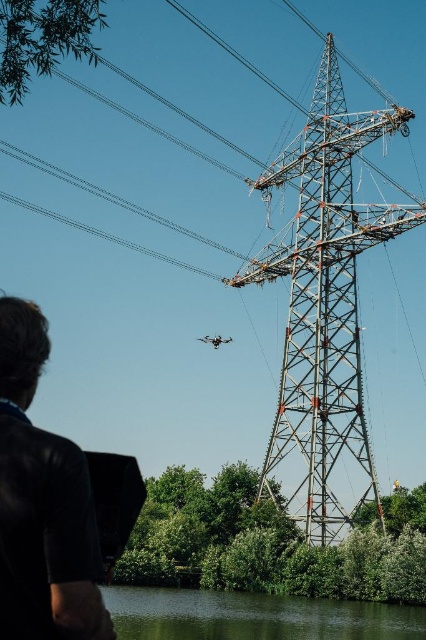
Question: Can you confirm if dark blue leather shirt at lower left is positioned below green smooth water at lower center?

Choices:
 (A) yes
 (B) no

Answer: (B)

Question: Among these points, which one is farthest from the camera?

Choices:
 (A) (302, 317)
 (B) (287, 602)
 (C) (14, 355)

Answer: (A)

Question: Which point appears closest to the camera in this image?

Choices:
 (A) (75, 540)
 (B) (187, 618)
 (C) (344, 296)

Answer: (A)

Question: Is the position of metallic gray tower at center-right less distant than that of dark blue leather shirt at lower left?

Choices:
 (A) no
 (B) yes

Answer: (A)

Question: Can you confirm if dark blue leather shirt at lower left is positioned above green smooth water at lower center?

Choices:
 (A) no
 (B) yes

Answer: (B)

Question: Estimate the real-world distances between objects in this image. Which object is farther from the green smooth water at lower center?

Choices:
 (A) dark blue leather shirt at lower left
 (B) metallic gray tower at center-right

Answer: (B)